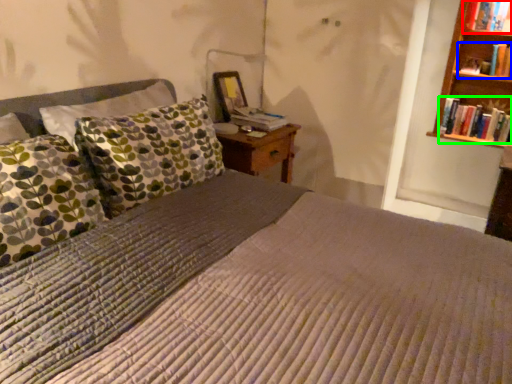
Question: Which is farther away from book (highlighted by a red box)? book (highlighted by a blue box) or book (highlighted by a green box)?

Choices:
 (A) book
 (B) book

Answer: (B)